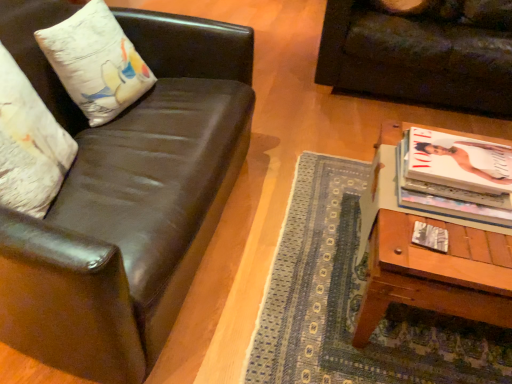
Question: Is matte white magazine at right thinner than dark brown leather couch at upper right, arranged as the 1th studio couch when viewed from the back?

Choices:
 (A) no
 (B) yes

Answer: (B)

Question: Is matte white magazine at right not close to dark brown leather couch at upper right, which is counted as the 2th studio couch, starting from the left?

Choices:
 (A) no
 (B) yes

Answer: (B)

Question: Would you say dark brown leather couch at upper right, the 1th studio couch in the right-to-left sequence, is part of matte white magazine at right's contents?

Choices:
 (A) yes
 (B) no

Answer: (B)

Question: Does matte white magazine at right have a lesser height compared to dark brown leather couch at upper right, the 1th studio couch in the right-to-left sequence?

Choices:
 (A) yes
 (B) no

Answer: (A)

Question: Is matte white magazine at right positioned behind dark brown leather couch at upper right, arranged as the 1th studio couch when viewed from the back?

Choices:
 (A) no
 (B) yes

Answer: (A)

Question: Does point (70, 44) appear closer or farther from the camera than point (438, 18)?

Choices:
 (A) farther
 (B) closer

Answer: (B)

Question: Looking at the image, does white cotton pillow at upper left, which is the 2th pillow in front-to-back order, seem bigger or smaller compared to dark brown leather couch at upper right, the 2th studio couch positioned from the front?

Choices:
 (A) small
 (B) big

Answer: (A)

Question: From their relative heights in the image, would you say white cotton pillow at upper left, the first pillow positioned from the back, is taller or shorter than dark brown leather couch at upper right, which is counted as the 2th studio couch, starting from the left?

Choices:
 (A) short
 (B) tall

Answer: (A)

Question: From a real-world perspective, is white cotton pillow at upper left, the first pillow positioned from the back, positioned above or below dark brown leather couch at upper right, the 2th studio couch positioned from the front?

Choices:
 (A) above
 (B) below

Answer: (A)

Question: From a real-world perspective, relative to white glossy magazine at right, is matte white magazine at right vertically above or below?

Choices:
 (A) below
 (B) above

Answer: (A)

Question: From the image's perspective, relative to white glossy magazine at right, is matte white magazine at right above or below?

Choices:
 (A) above
 (B) below

Answer: (B)

Question: Is matte white magazine at right taller or shorter than white glossy magazine at right?

Choices:
 (A) tall
 (B) short

Answer: (B)

Question: Is matte white magazine at right in front of or behind white glossy magazine at right in the image?

Choices:
 (A) behind
 (B) front

Answer: (B)

Question: Is point (439, 211) closer or farther from the camera than point (181, 292)?

Choices:
 (A) closer
 (B) farther

Answer: (A)

Question: Is white glossy magazine at right bigger or smaller than shiny black leather couch at left, arranged as the second studio couch when viewed from the right?

Choices:
 (A) small
 (B) big

Answer: (A)